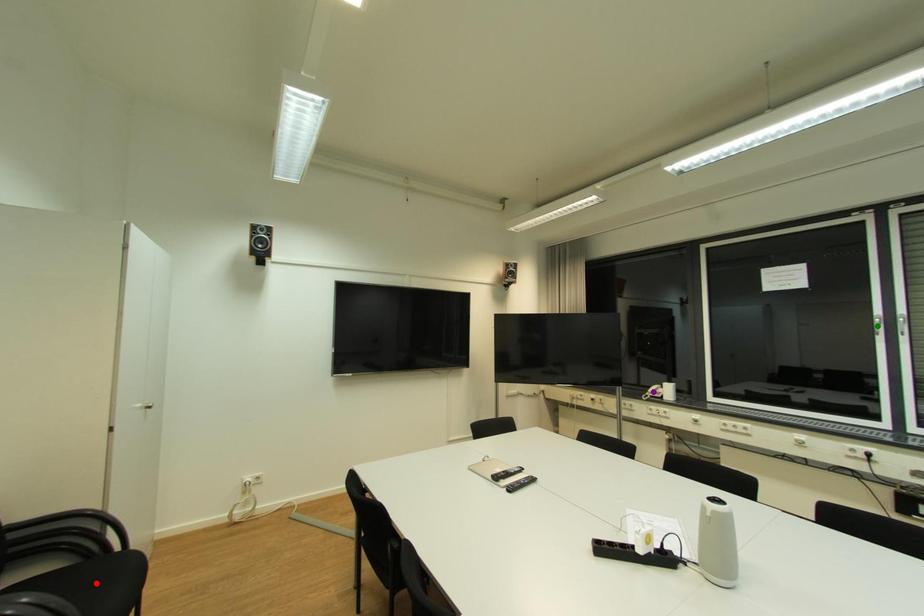
Looking at this image, order these from nearest to farthest:
A) green point
B) red point
C) purple point

purple point
green point
red point